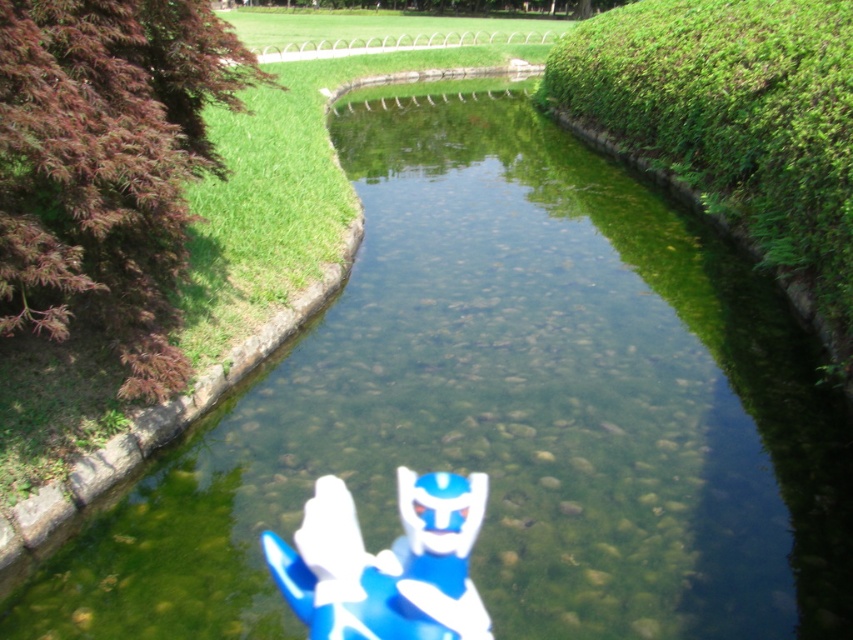
You are standing in the park and want to find the purple leafy hedge at left. According to the scene description, where should you look relative to the canal?

The purple leafy hedge at left is located at point (107,166), which is on the left side of the canal.

You are a gardener planning to trim both the purple leafy hedge at left and the green leafy hedge at right. Based on their current sizes, which hedge will require more time to trim?

The green leafy hedge at right requires more time to trim because it is thicker than the purple leafy hedge at left.

You are standing at the edge of the canal and want to place a small floating toy at the point marked by coordinates point (735, 125). According to the scene description, where will this toy be placed relative to the green leafy hedge at right?

The point (735, 125) is on the green leafy hedge at right, so the toy will be placed directly on the hedge.